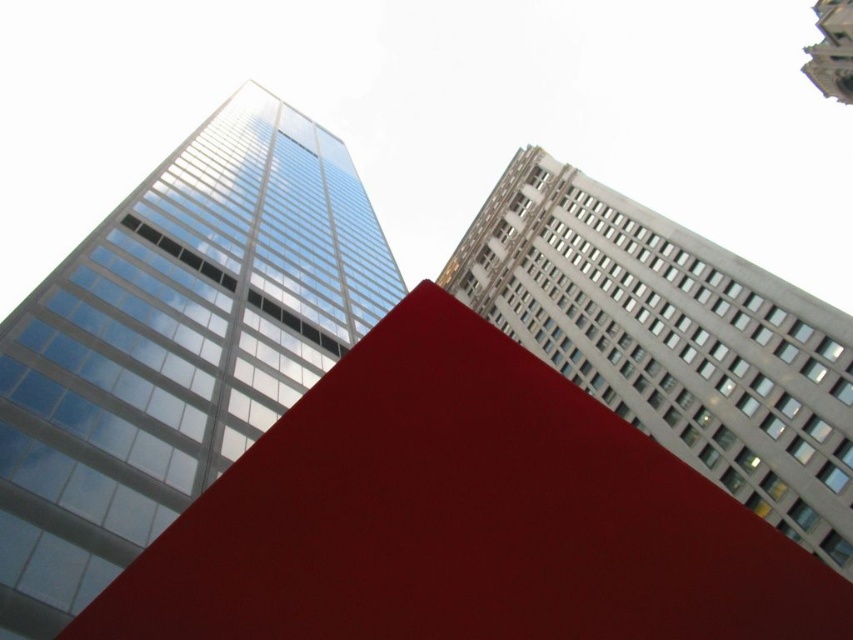
Question: Does glassy reflective skyscraper at left have a greater width compared to smooth stone tower at upper right?

Choices:
 (A) yes
 (B) no

Answer: (A)

Question: Estimate the real-world distances between objects in this image. Which object is closer to the white textured building at upper right?

Choices:
 (A) smooth stone tower at upper right
 (B) glassy reflective skyscraper at left

Answer: (B)

Question: Estimate the real-world distances between objects in this image. Which object is closer to the smooth stone tower at upper right?

Choices:
 (A) glassy reflective skyscraper at left
 (B) white textured building at upper right

Answer: (B)

Question: Which point is farther from the camera taking this photo?

Choices:
 (A) pyautogui.click(x=138, y=376)
 (B) pyautogui.click(x=701, y=385)
 (C) pyautogui.click(x=843, y=29)

Answer: (C)

Question: Does glassy reflective skyscraper at left come in front of smooth stone tower at upper right?

Choices:
 (A) no
 (B) yes

Answer: (B)

Question: Does glassy reflective skyscraper at left have a lesser width compared to smooth stone tower at upper right?

Choices:
 (A) no
 (B) yes

Answer: (A)